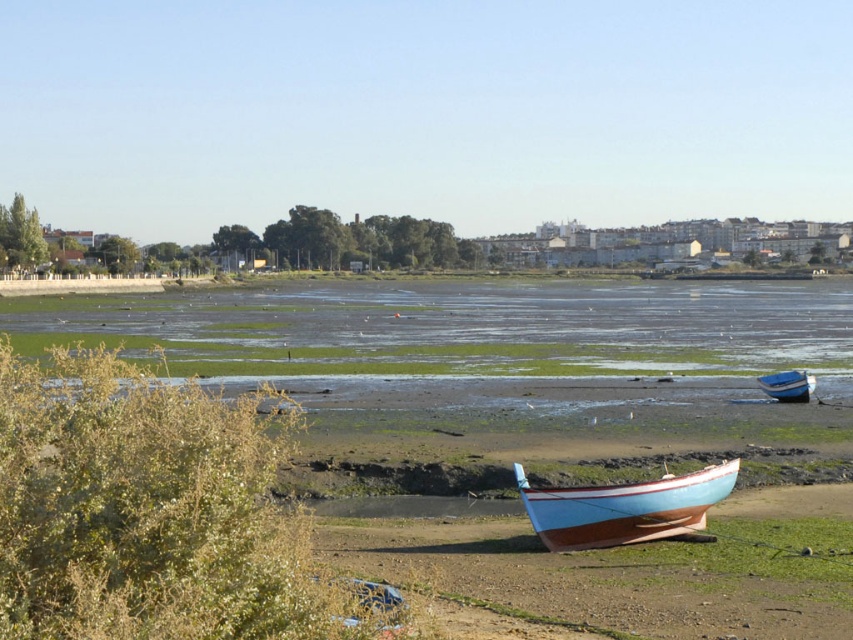
Question: Which object appears farthest from the camera in this image?

Choices:
 (A) blue wooden boat at lower right
 (B) light blue wooden boat at lower center

Answer: (A)

Question: Which of the following is the closest to the observer?

Choices:
 (A) (785, 376)
 (B) (674, 522)

Answer: (B)

Question: Can you confirm if light blue wooden boat at lower center is thinner than blue wooden boat at lower right?

Choices:
 (A) yes
 (B) no

Answer: (B)

Question: Does light blue wooden boat at lower center appear over blue wooden boat at lower right?

Choices:
 (A) yes
 (B) no

Answer: (B)

Question: Is light blue wooden boat at lower center above blue wooden boat at lower right?

Choices:
 (A) yes
 (B) no

Answer: (B)